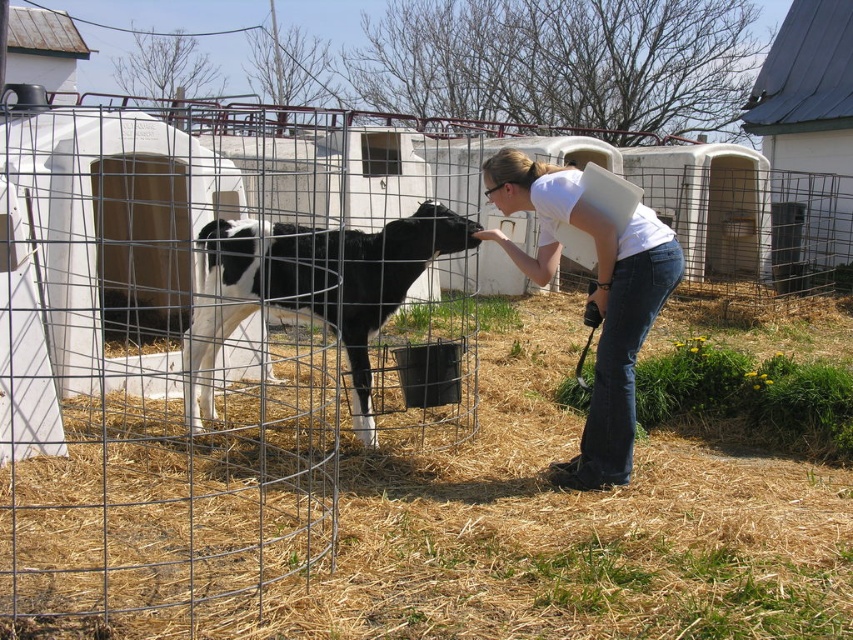
The height and width of the screenshot is (640, 853). Find the location of `black and white fur at center`. black and white fur at center is located at coordinates (312, 289).

Between black and white fur at center and white cotton shirt at center, which one appears on the right side from the viewer's perspective?

white cotton shirt at center is more to the right.

Where is `black and white fur at center`? This screenshot has width=853, height=640. black and white fur at center is located at coordinates (312, 289).

Consider the image. Does dry straw at lower center lie in front of black and white fur at center?

No, dry straw at lower center is further to the viewer.

The width and height of the screenshot is (853, 640). I want to click on dry straw at lower center, so click(x=575, y=525).

Is dry straw at lower center closer to the viewer compared to white cotton shirt at center?

Yes, it is in front of white cotton shirt at center.

Is dry straw at lower center wider than white cotton shirt at center?

Correct, the width of dry straw at lower center exceeds that of white cotton shirt at center.

Who is more forward, (x=755, y=524) or (x=619, y=353)?

Point (x=755, y=524)

I want to click on dry straw at lower center, so click(x=575, y=525).